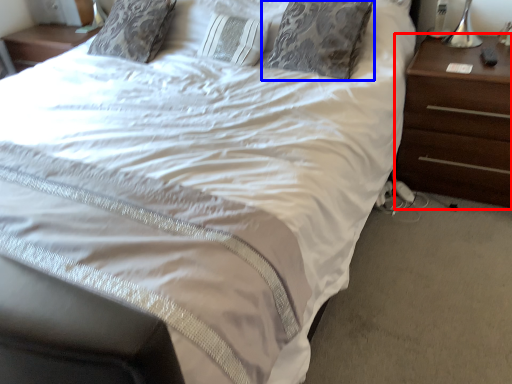
Question: Which of the following is the farthest to the observer, nightstand (highlighted by a red box) or pillow (highlighted by a blue box)?

Choices:
 (A) nightstand
 (B) pillow

Answer: (B)